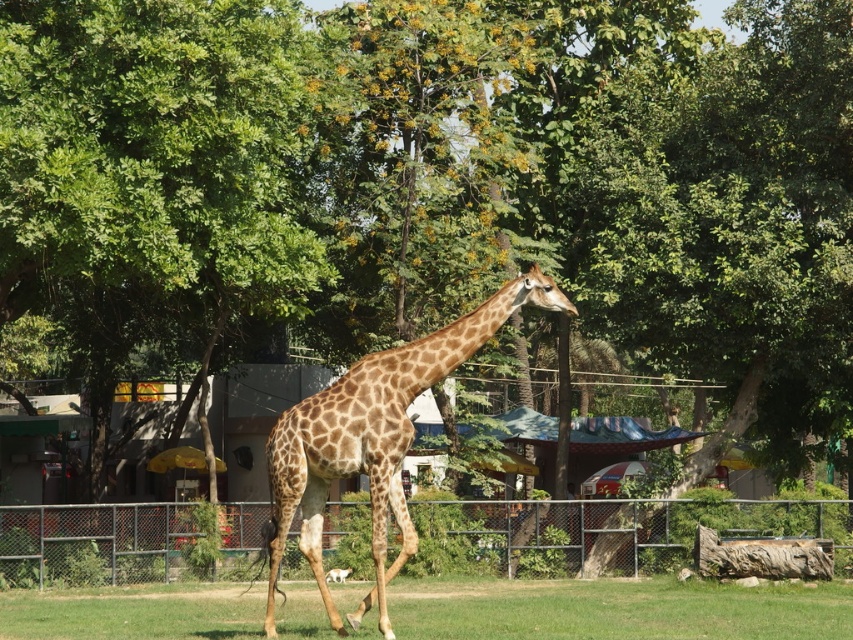
You are a zookeeper trying to feed the spotted fur giraffe at center. You have a bucket of food placed at the base of the green leafy tree at center. To reach the giraffe, should you move the bucket to the left or right of the tree?

The green leafy tree at center is positioned on the left side of the spotted fur giraffe at center. Therefore, to reach the giraffe, you should move the bucket to the right of the tree.

You are a zookeeper trying to determine if the metallic silver fence at lower center can be seen from the path behind the spotted fur giraffe at center. Based on their sizes, can the fence be seen behind the giraffe?

The metallic silver fence at lower center is bigger than the spotted fur giraffe at center. Since the fence is larger, it might partially or fully block the view of the giraffe depending on their positions, but the question is about the fence being seen behind the giraffe. However, since the giraffe is at center and the fence is at lower center, the giraffe might be in front of the fence. Therefore, the fence might be partially visible behind the giraffe if the giraffe is in front but not covering the whole